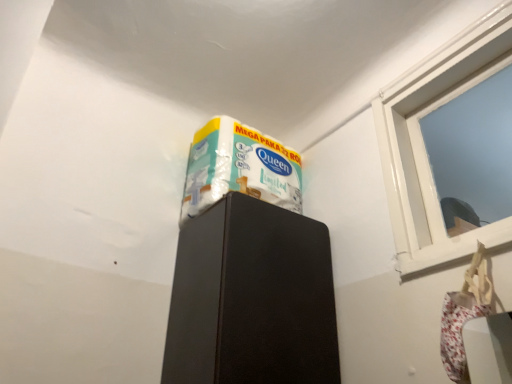
Question: From the image's perspective, is black matte cabinet at upper center located above or below white glossy window at upper right?

Choices:
 (A) below
 (B) above

Answer: (A)

Question: In terms of width, does black matte cabinet at upper center look wider or thinner when compared to white glossy window at upper right?

Choices:
 (A) thin
 (B) wide

Answer: (B)

Question: Which object is the farthest from the white glossy window at upper right?

Choices:
 (A) black matte cabinet at upper center
 (B) white glossy wrapping paper at upper center

Answer: (B)

Question: Which object is positioned farthest from the white glossy wrapping paper at upper center?

Choices:
 (A) white glossy window at upper right
 (B) black matte cabinet at upper center

Answer: (A)